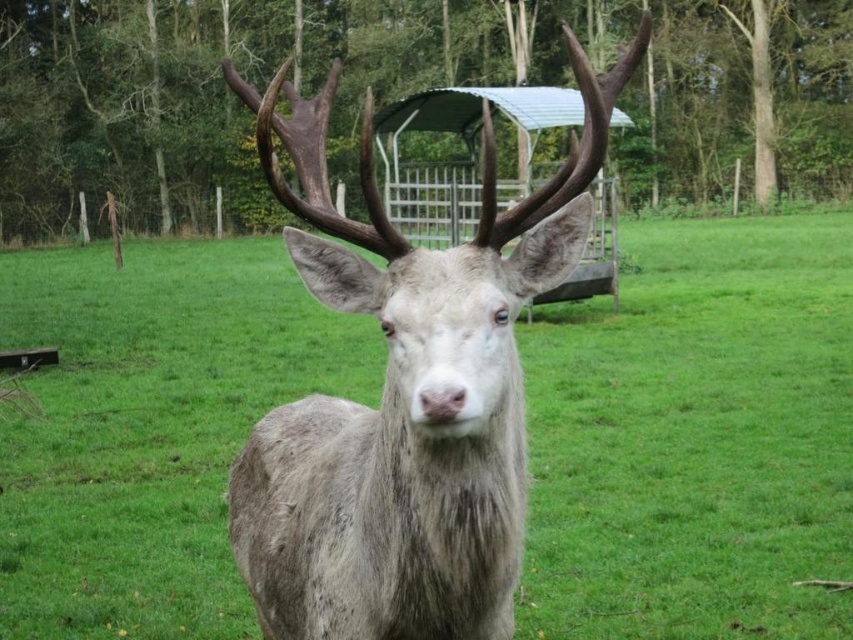
Is point (136, 518) less distant than point (523, 228)?

No.

Which is in front, point (22, 554) or point (453, 301)?

Point (453, 301) is more forward.

Find the location of `green grassy at center`. green grassy at center is located at coordinates (695, 440).